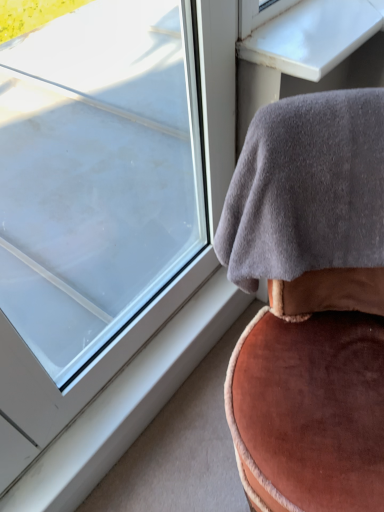
Question: Considering the positions of white plastic window sill at lower left and transparent glass window at upper left in the image, is white plastic window sill at lower left wider or thinner than transparent glass window at upper left?

Choices:
 (A) thin
 (B) wide

Answer: (B)

Question: From a real-world perspective, is white plastic window sill at lower left positioned above or below transparent glass window at upper left?

Choices:
 (A) above
 (B) below

Answer: (B)

Question: Estimate the real-world distances between objects in this image. Which object is closer to the transparent glass window at upper left?

Choices:
 (A) white glossy table at upper right
 (B) gray fleece blanket at upper right
 (C) white plastic window sill at lower left

Answer: (C)

Question: Which object is positioned closest to the white plastic window sill at lower left?

Choices:
 (A) transparent glass window at upper left
 (B) gray fleece blanket at upper right
 (C) white glossy table at upper right

Answer: (B)